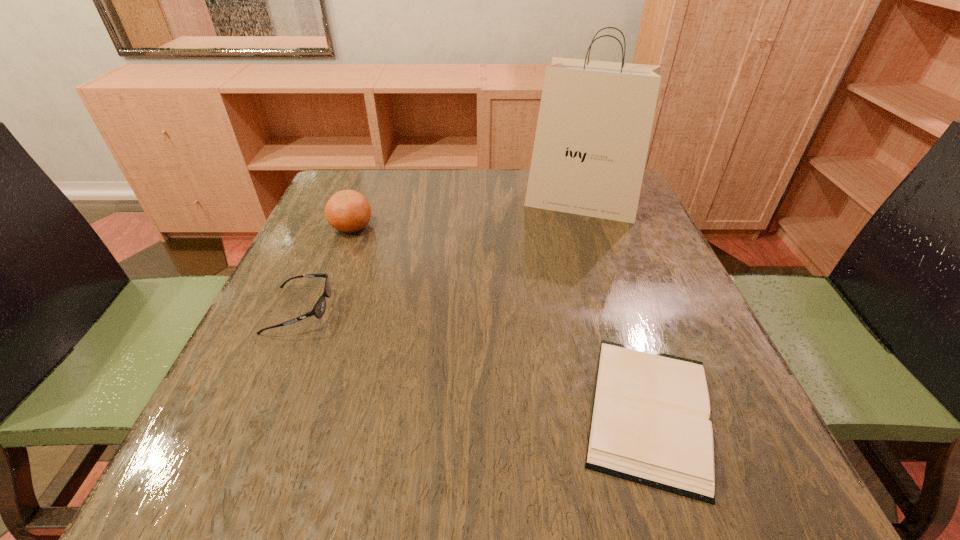
At what (x,y) coordinates should I click in order to perform the action: click on free space at the far edge of the desktop. Please return your answer as a coordinate pair (x, y). The image size is (960, 540). Looking at the image, I should click on (482, 187).

In the image, there is a desktop. Find the location of `vacant space at the near edge`. vacant space at the near edge is located at coordinates (412, 501).

Find the location of a particular element. free region at the left edge is located at coordinates (330, 271).

Find the location of `vacant space at the right edge of the desktop`. vacant space at the right edge of the desktop is located at coordinates (631, 224).

The width and height of the screenshot is (960, 540). In the image, there is a desktop. What are the coordinates of `vacant space at the far left corner` in the screenshot? It's located at (349, 179).

At what (x,y) coordinates should I click in order to perform the action: click on free space at the near right corner of the desktop. Please return your answer as a coordinate pair (x, y). The image size is (960, 540). Looking at the image, I should click on (775, 486).

Locate an element on the screen. The image size is (960, 540). free space that is in between the shortest object and the second tallest object is located at coordinates (500, 319).

The width and height of the screenshot is (960, 540). What are the coordinates of `free space between the second tallest object and the sunglasses` in the screenshot? It's located at (325, 268).

Find the location of `unoccupied area between the shortest object and the tallest object`. unoccupied area between the shortest object and the tallest object is located at coordinates (615, 306).

Find the location of `free space between the clementine and the nearest object`. free space between the clementine and the nearest object is located at coordinates (500, 319).